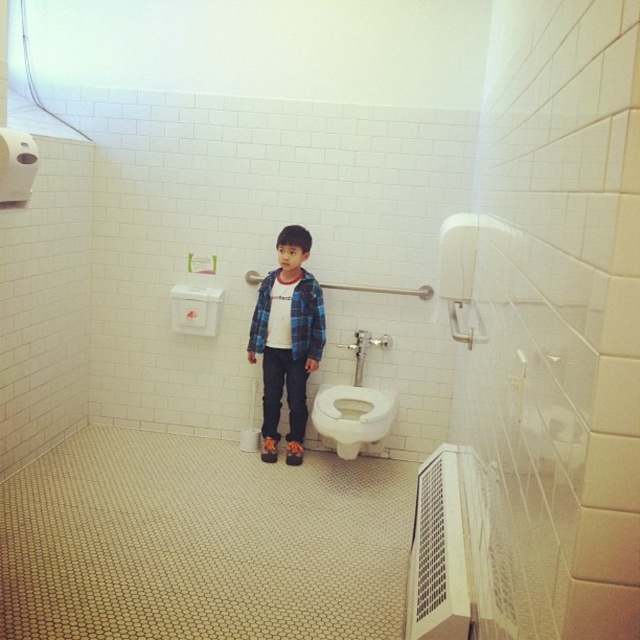
Based on the scene description, which object is bigger between the matte plaid shirt at center and the white glossy toilet at lower center?

The matte plaid shirt at center is larger in size than the white glossy toilet at lower center according to the description.